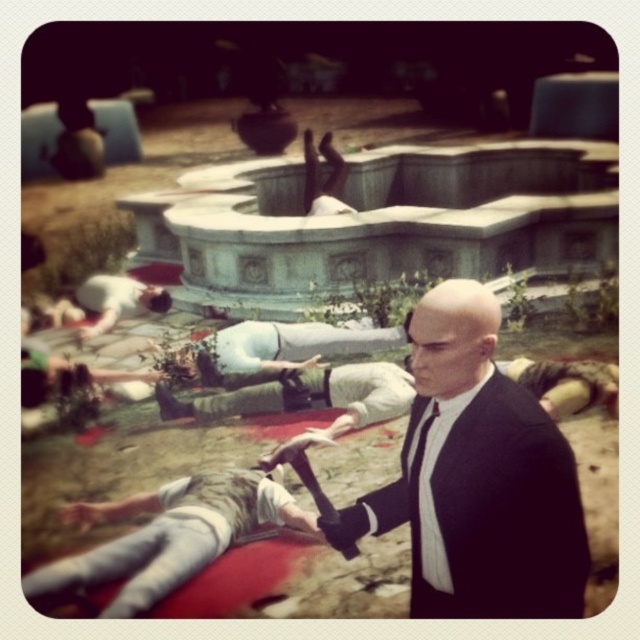
Who is higher up, black matte suit at center or white textured tie at center?

black matte suit at center is above.

Is point (433, 337) less distant than point (413, 556)?

Yes, point (433, 337) is closer to viewer.

You are a GUI agent. You are given a task and a screenshot of the screen. Output one action in this format:
    pyautogui.click(x=<x>, y=<y>)
    Task: Click on the black matte suit at center
    This screenshot has height=640, width=640.
    Given the screenshot: What is the action you would take?
    pyautogui.click(x=477, y=477)

Where is `black matte suit at center`? black matte suit at center is located at coordinates (477, 477).

Can you confirm if black matte suit at center is positioned below smooth skin hand at lower left?

Yes.

Can you confirm if black matte suit at center is shorter than smooth skin hand at lower left?

Incorrect, black matte suit at center's height does not fall short of smooth skin hand at lower left's.

Who is more distant from viewer, (516, 566) or (88, 336)?

Positioned behind is point (88, 336).

This screenshot has height=640, width=640. Find the location of `black matte suit at center`. black matte suit at center is located at coordinates (477, 477).

Does white textured tie at center have a greater height compared to smooth skin hand at lower left?

Correct, white textured tie at center is much taller as smooth skin hand at lower left.

Image resolution: width=640 pixels, height=640 pixels. Describe the element at coordinates (428, 499) in the screenshot. I see `white textured tie at center` at that location.

Which is in front, point (422, 522) or point (86, 340)?

Point (422, 522) is in front.

Locate an element on the screen. The height and width of the screenshot is (640, 640). white textured tie at center is located at coordinates (428, 499).